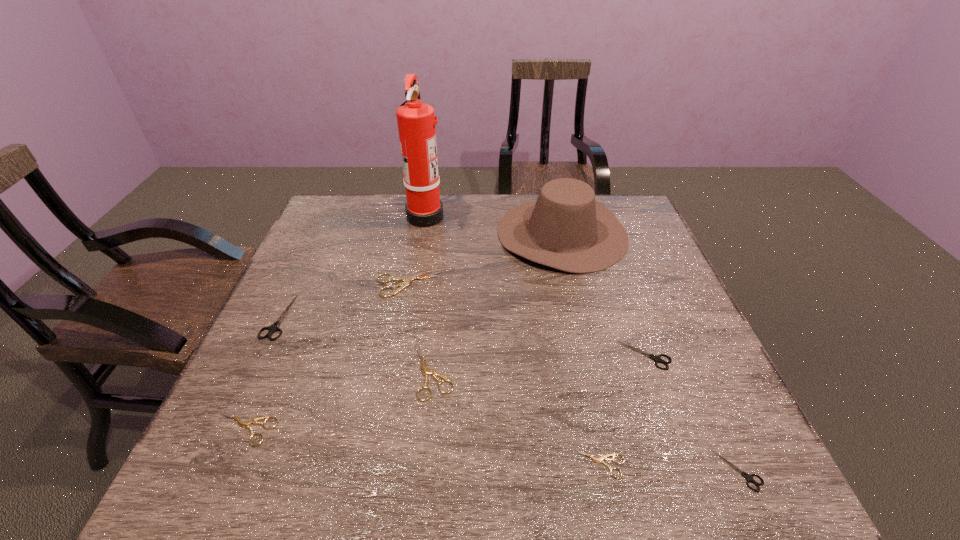
Identify the location of the fifth farthest shears. (244, 424).

Where is `the rightmost shears`? This screenshot has width=960, height=540. the rightmost shears is located at coordinates (749, 477).

This screenshot has height=540, width=960. I want to click on the rightmost black shears, so click(x=749, y=477).

This screenshot has width=960, height=540. I want to click on the rightmost beige shears, so click(599, 460).

Locate an element on the screen. The height and width of the screenshot is (540, 960). the shortest object is located at coordinates (599, 460).

Find the location of a particular element. The image size is (960, 540). free space located 0.270m at the nozzle of the fire extinguisher is located at coordinates (527, 215).

At what (x,y) coordinates should I click in order to perform the action: click on free spot located 0.100m on the left of the eighth shortest object. Please return your answer as a coordinate pair (x, y). The image size is (960, 540). Looking at the image, I should click on (x=465, y=233).

Where is `free space located 0.070m on the back of the leftmost black shears`? The width and height of the screenshot is (960, 540). free space located 0.070m on the back of the leftmost black shears is located at coordinates (297, 278).

What are the coordinates of `vacant space located on the front of the farthest beige shears` in the screenshot? It's located at (387, 407).

This screenshot has width=960, height=540. I want to click on vacant space located on the front of the second biggest black shears, so click(x=694, y=492).